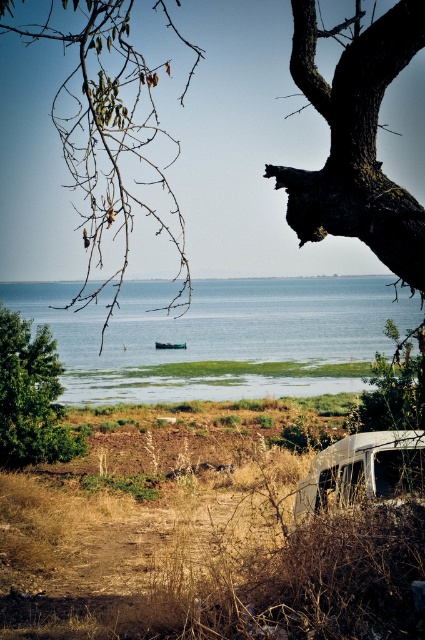
Is green leafy tree at lower left taller than rusty metal van at lower right?

Yes, green leafy tree at lower left is taller than rusty metal van at lower right.

Can you confirm if green leafy tree at lower left is thinner than rusty metal van at lower right?

No.

Locate an element on the screen. This screenshot has width=425, height=640. green leafy tree at lower left is located at coordinates (31, 396).

From the picture: Which of these two, green leafy branch at left or green leafy tree at lower left, stands taller?

With more height is green leafy branch at left.

Between point (25, 38) and point (44, 380), which one is positioned behind?

The point (25, 38) is more distant.

Locate an element on the screen. The image size is (425, 640). green leafy branch at left is located at coordinates (107, 132).

Is green grassy water at center taller than green plastic boat at center?

Yes, green grassy water at center is taller than green plastic boat at center.

What do you see at coordinates (220, 337) in the screenshot? The height and width of the screenshot is (640, 425). I see `green grassy water at center` at bounding box center [220, 337].

Image resolution: width=425 pixels, height=640 pixels. Identify the location of green grassy water at center. (220, 337).